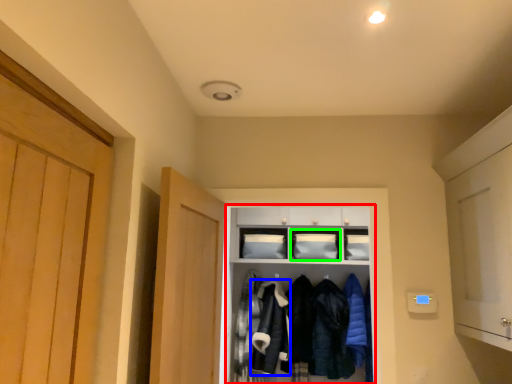
Question: Estimate the real-world distances between objects in this image. Which object is farther from cabinetry (highlighted by a red box), clothing (highlighted by a blue box) or cabinetry (highlighted by a green box)?

Choices:
 (A) clothing
 (B) cabinetry

Answer: (A)